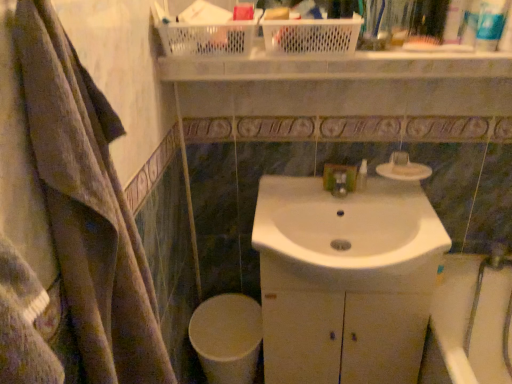
The image size is (512, 384). Find the location of `free space above white plastic basket at upper center (from a real-world perspective)`. free space above white plastic basket at upper center (from a real-world perspective) is located at coordinates click(x=374, y=46).